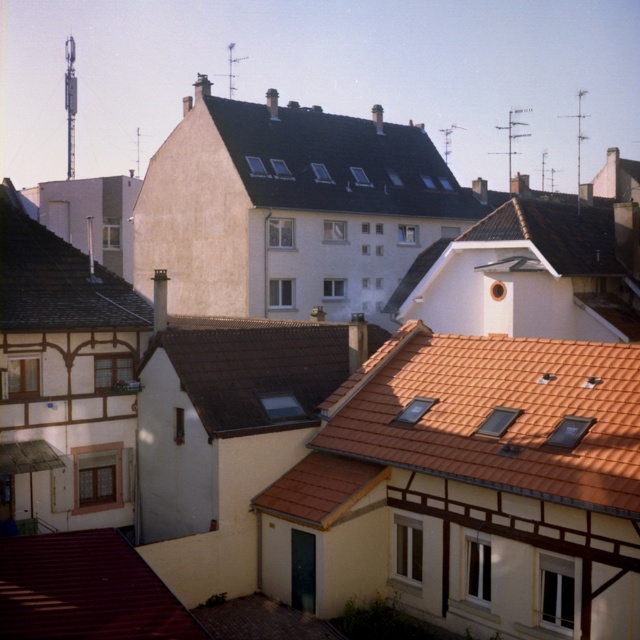
In the scene shown: You are standing on a balcony 100 feet away from the brown tile roof at center. Can you reach it by walking straight ahead?

The brown tile roof at center is 92.09 feet away from the viewer. Since you are standing 100 feet away, you are still 7.91 feet away from reaching it by walking straight ahead.

Consider the image. You are a city planner reviewing aerial images of a European neighborhood. You notice two roofs labeled as orange tile roof at center and brown tile roof at center. Based on the image, which of these two roofs has a larger footprint in the scene?

The brown tile roof at center has a larger footprint than the orange tile roof at center because the orange tile roof at center occupies less space than brown tile roof at center.

In the scene shown: You are standing on a balcony overlooking the rooftops. You notice the brown tile roof at center and the gray slate roof at upper left. Which roof would appear closer to you based on their positions?

The brown tile roof at center appears closer because it is positioned in front of the gray slate roof at upper left.